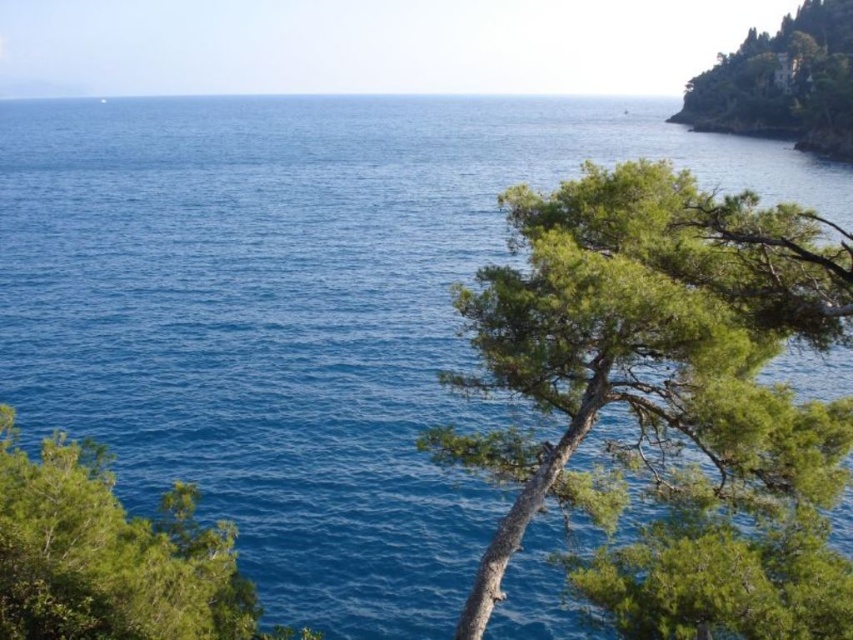
You are a bird looking for a place to perch. You see the green textured tree at right and the green leafy tree at lower left. Which tree is higher up in the scene?

The green textured tree at right is higher up in the scene because it is positioned above the green leafy tree at lower left.

You are a hiker who wants to take a photo of the green textured tree at right from the point marked at point (668, 397). Is the tree visible from that point?

The green textured tree at right is located exactly at point (668, 397), so you are standing right at the tree. Therefore, the tree would be directly beneath or around you, making it difficult to see the entire tree from that position.